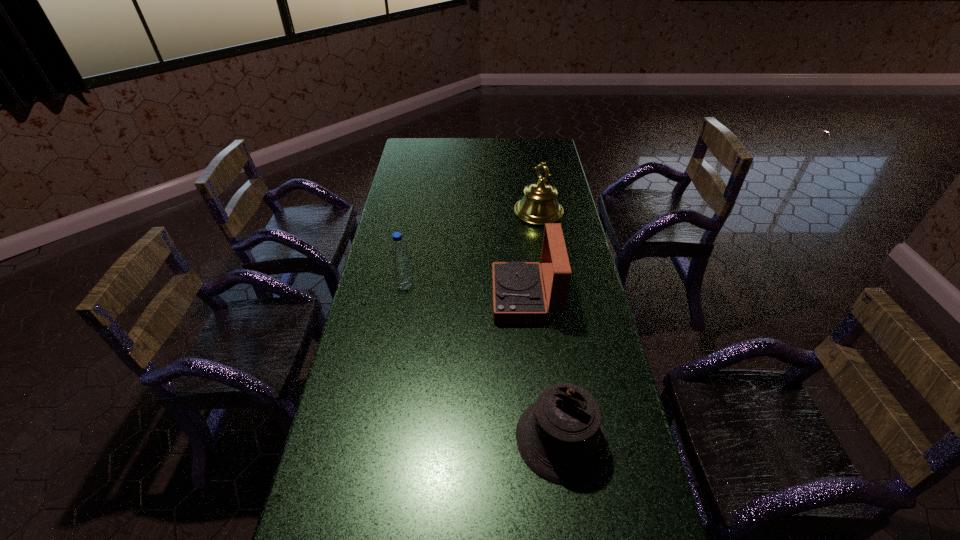
Where is `object present at the left edge`? This screenshot has width=960, height=540. object present at the left edge is located at coordinates (399, 252).

Image resolution: width=960 pixels, height=540 pixels. In order to click on phonograph record that is at the right edge in this screenshot , I will do `click(518, 295)`.

In the image, there is a desktop. Identify the location of vacant region at the far edge. The height and width of the screenshot is (540, 960). (487, 141).

Where is `vacant space at the left edge`? Image resolution: width=960 pixels, height=540 pixels. vacant space at the left edge is located at coordinates (417, 224).

In the image, there is a desktop. Identify the location of vacant region at the right edge. (564, 195).

Locate an element on the screen. The height and width of the screenshot is (540, 960). free point between the farther bell and the phonograph record is located at coordinates (532, 255).

Locate an element on the screen. free area in between the nearer bell and the leftmost object is located at coordinates (483, 362).

Where is `free spot between the water bottle and the nearer bell`? This screenshot has height=540, width=960. free spot between the water bottle and the nearer bell is located at coordinates [483, 362].

Find the location of a particular element. This screenshot has height=540, width=960. free space that is in between the farther bell and the leftmost object is located at coordinates (471, 249).

At what (x,y) coordinates should I click in order to perform the action: click on vacant space that is in between the nearest object and the phonograph record. Please return your answer as a coordinate pair (x, y). This screenshot has width=960, height=540. Looking at the image, I should click on (543, 368).